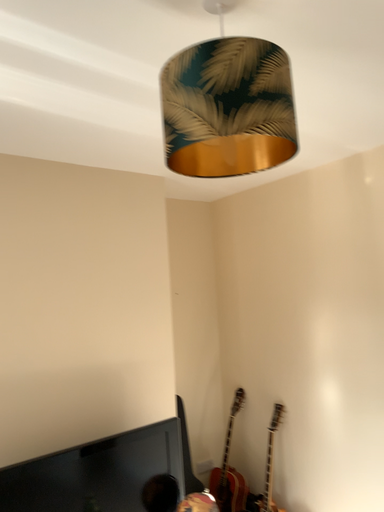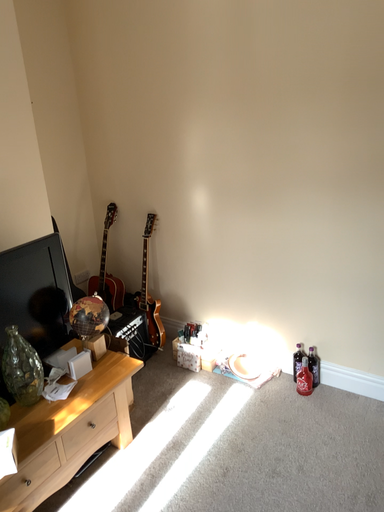
Question: How did the camera likely rotate when shooting the video?

Choices:
 (A) rotated right
 (B) rotated left

Answer: (A)